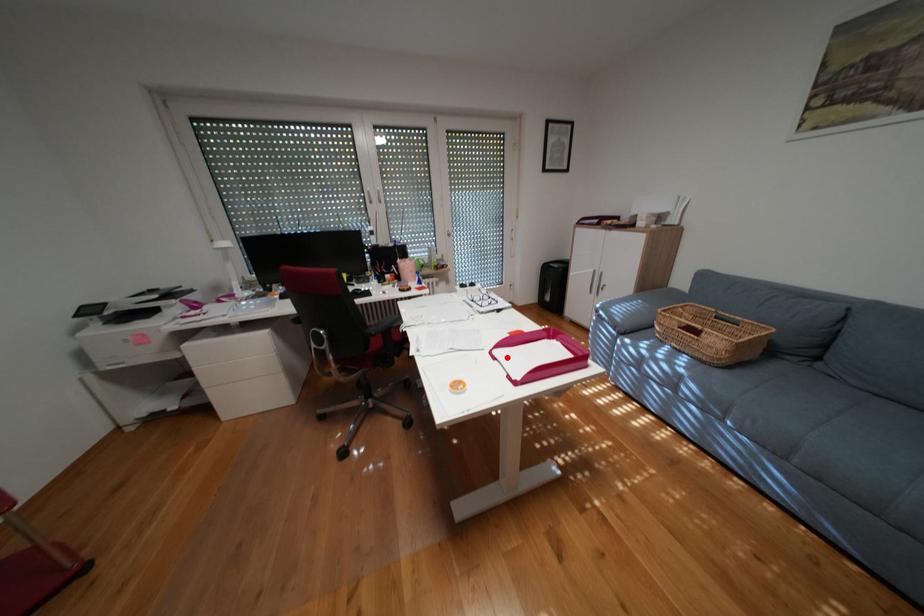
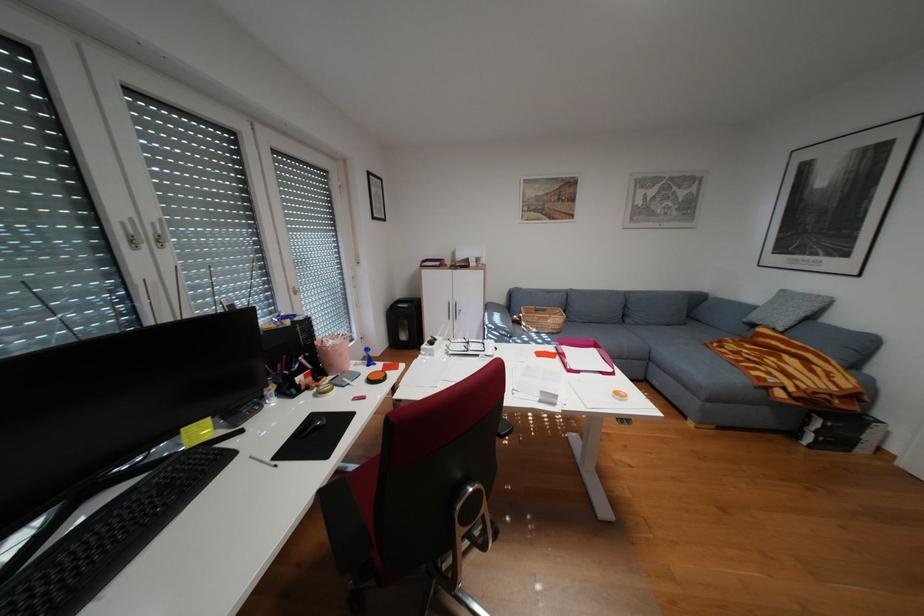
Find the pixel in the second image that matches the highlighted location in the first image.

(590, 371)